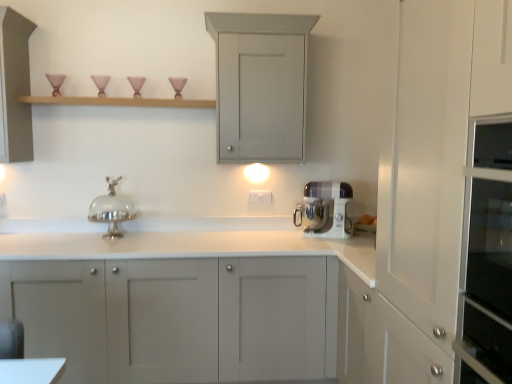
Question: Does white plastic stand mixer at center have a larger size compared to wooden shelf at upper center?

Choices:
 (A) yes
 (B) no

Answer: (A)

Question: Can you see white plastic stand mixer at center touching wooden shelf at upper center?

Choices:
 (A) no
 (B) yes

Answer: (A)

Question: Is white plastic stand mixer at center closer to the viewer compared to wooden shelf at upper center?

Choices:
 (A) yes
 (B) no

Answer: (B)

Question: Is white plastic stand mixer at center positioned behind wooden shelf at upper center?

Choices:
 (A) yes
 (B) no

Answer: (A)

Question: Could wooden shelf at upper center be considered to be inside white plastic stand mixer at center?

Choices:
 (A) no
 (B) yes

Answer: (A)

Question: Is white plastic stand mixer at center taller than wooden shelf at upper center?

Choices:
 (A) no
 (B) yes

Answer: (B)

Question: Can you confirm if wooden shelf at upper center is shorter than matte gray cabinet at center, the third cabinetry viewed from the top?

Choices:
 (A) no
 (B) yes

Answer: (B)

Question: From the image's perspective, is wooden shelf at upper center located beneath matte gray cabinet at center, marked as the first cabinetry in a bottom-to-top arrangement?

Choices:
 (A) no
 (B) yes

Answer: (A)

Question: Does wooden shelf at upper center come in front of matte gray cabinet at center, the third cabinetry viewed from the top?

Choices:
 (A) no
 (B) yes

Answer: (A)

Question: From a real-world perspective, is wooden shelf at upper center physically below matte gray cabinet at center, the third cabinetry viewed from the top?

Choices:
 (A) yes
 (B) no

Answer: (B)

Question: Does wooden shelf at upper center have a greater height compared to matte gray cabinet at center, marked as the first cabinetry in a bottom-to-top arrangement?

Choices:
 (A) yes
 (B) no

Answer: (B)

Question: Is wooden shelf at upper center at the left side of matte gray cabinet at center, the third cabinetry viewed from the top?

Choices:
 (A) yes
 (B) no

Answer: (A)

Question: Considering the relative positions of white plastic stand mixer at center and silver metallic cake stand at center in the image provided, is white plastic stand mixer at center behind silver metallic cake stand at center?

Choices:
 (A) yes
 (B) no

Answer: (A)